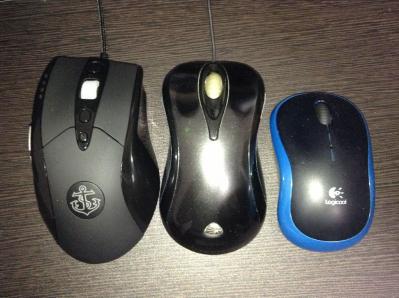
The height and width of the screenshot is (298, 399). What are the coordinates of `blue edging on mouse` in the screenshot? It's located at (286, 186).